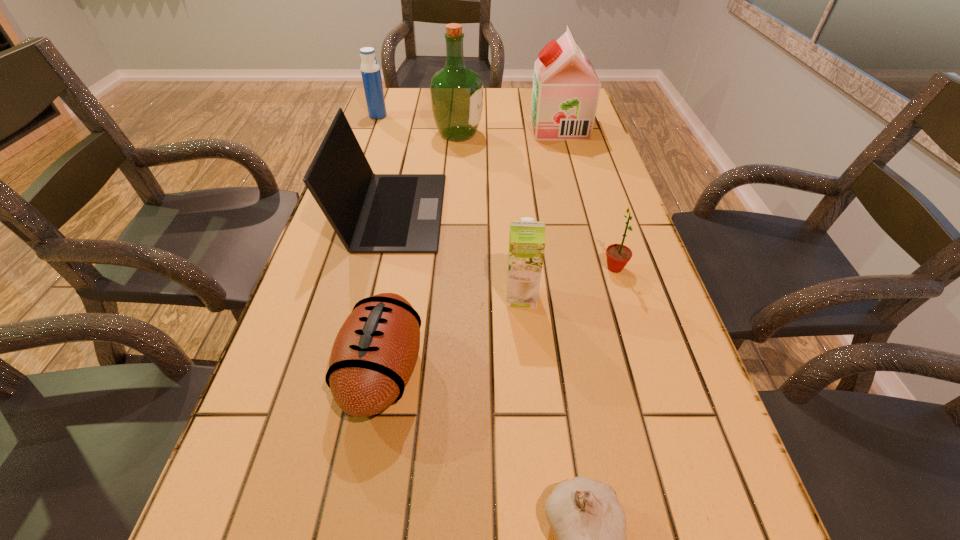
The image size is (960, 540). Find the location of `liquor`. liquor is located at coordinates (456, 91).

I want to click on the farther soya milk, so click(x=566, y=88).

Locate an element on the screen. Image resolution: width=960 pixels, height=540 pixels. the taller soya milk is located at coordinates (566, 88).

Identify the location of water bottle. The width and height of the screenshot is (960, 540). (370, 70).

Locate an element on the screen. The height and width of the screenshot is (540, 960). laptop is located at coordinates (371, 213).

Find the location of a particular element. Image resolution: width=960 pixels, height=540 pixels. the left soya milk is located at coordinates (527, 238).

Identify the location of the shorter soya milk. This screenshot has width=960, height=540. (527, 238).

At what (x,y) coordinates should I click in order to perform the action: click on the fourth nearest object. Please return your answer as a coordinate pair (x, y). The image size is (960, 540). Looking at the image, I should click on (618, 255).

The height and width of the screenshot is (540, 960). I want to click on the second nearest object, so click(x=374, y=354).

Identify the location of the second shortest object. Image resolution: width=960 pixels, height=540 pixels. [374, 354].